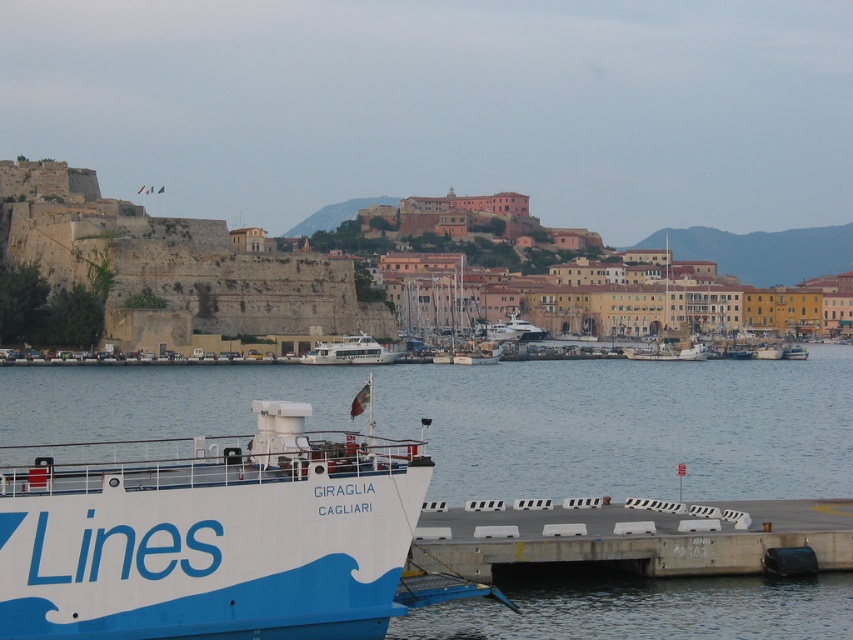
Question: Considering the relative positions of white matte ship at lower left and white glossy ferry at center in the image provided, where is white matte ship at lower left located with respect to white glossy ferry at center?

Choices:
 (A) right
 (B) left

Answer: (B)

Question: Which point appears closest to the camera in this image?

Choices:
 (A) (315, 349)
 (B) (747, 531)

Answer: (B)

Question: Where is transparent water at center located in relation to white wooden sailboats at center in the image?

Choices:
 (A) left
 (B) right

Answer: (B)

Question: Which point is farther to the camera?

Choices:
 (A) white matte boat at center
 (B) white wooden sailboats at center
 (C) white matte ship at lower left

Answer: (A)

Question: Among these objects, which one is nearest to the camera?

Choices:
 (A) concrete at lower right
 (B) white matte ship at lower left
 (C) white wooden sailboats at center

Answer: (B)

Question: Where is white matte ship at lower left located in relation to white wooden sailboats at center in the image?

Choices:
 (A) left
 (B) right

Answer: (A)